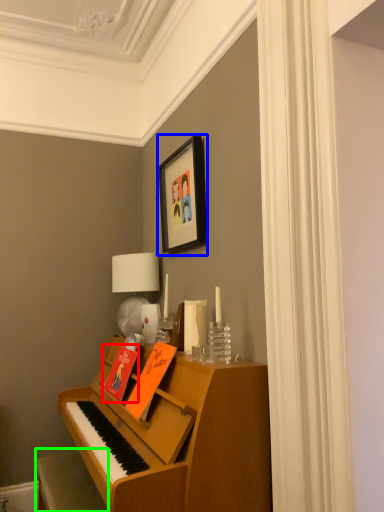
Question: Considering the real-world distances, which object is closest to book (highlighted by a red box)? picture frame (highlighted by a blue box) or furniture (highlighted by a green box).

Choices:
 (A) picture frame
 (B) furniture

Answer: (B)